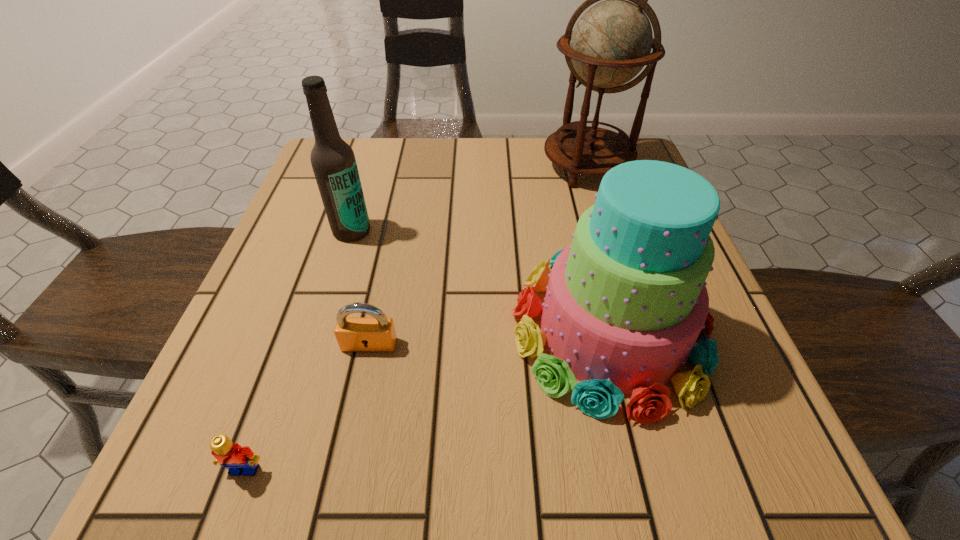
This screenshot has width=960, height=540. What are the coordinates of `free space at the far edge of the desktop` in the screenshot? It's located at (495, 136).

At what (x,y) coordinates should I click in order to perform the action: click on free region at the left edge of the desktop. Please return your answer as a coordinate pair (x, y). Looking at the image, I should click on (297, 268).

In order to click on blank area at the far left corner in this screenshot , I will do `click(317, 189)`.

Identify the location of free spot between the globe and the Lego. (416, 318).

Identify the location of empty location between the cake and the third object from left to right. This screenshot has width=960, height=540. point(489,337).

At what (x,y) coordinates should I click in order to perform the action: click on blank region between the fourth nearest object and the third object from right to left. Please return your answer as a coordinate pair (x, y). This screenshot has height=540, width=960. Looking at the image, I should click on (361, 288).

Identify the location of empty space that is in between the nearest object and the fourth nearest object. The image size is (960, 540). [x=299, y=350].

The width and height of the screenshot is (960, 540). Find the location of `vacant space that is in between the padlock and the cake`. vacant space that is in between the padlock and the cake is located at coordinates (489, 337).

Where is `vacant point located between the Lego and the cake`? The image size is (960, 540). vacant point located between the Lego and the cake is located at coordinates (427, 400).

The width and height of the screenshot is (960, 540). I want to click on free space between the third object from right to left and the Lego, so click(x=307, y=407).